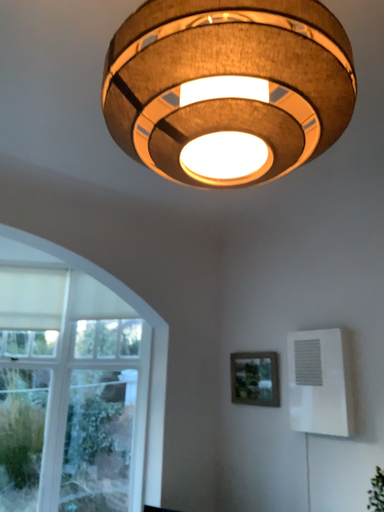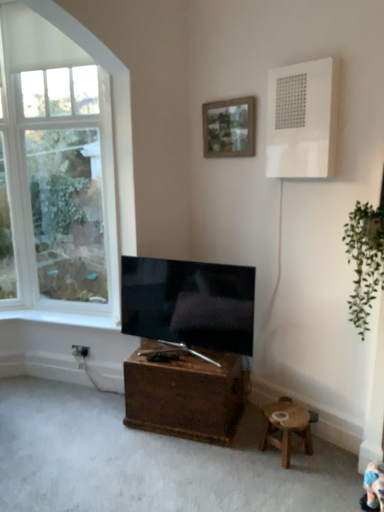
Question: How did the camera likely rotate when shooting the video?

Choices:
 (A) rotated downward
 (B) rotated upward

Answer: (A)